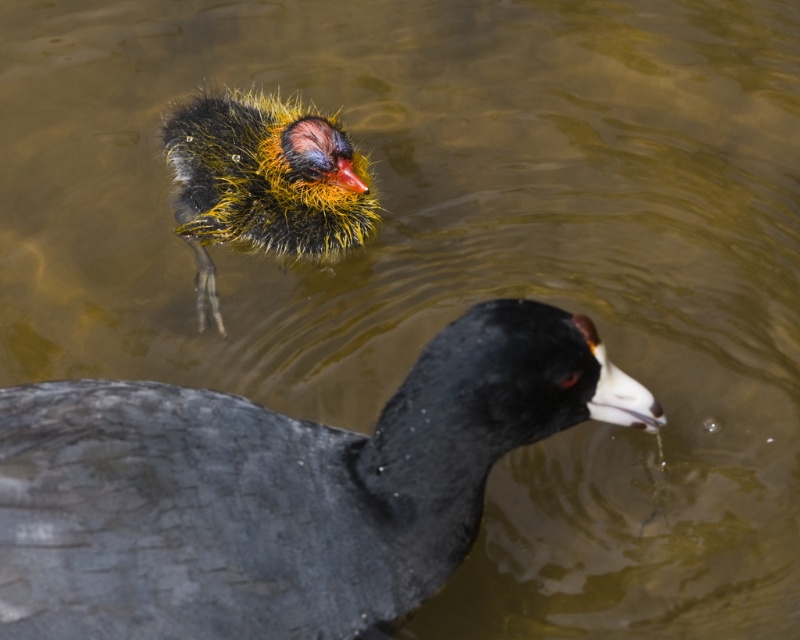
You are standing 1.5 meters away from the point marked at coordinates point (186, 548). Can you reach the point without moving closer?

The distance of point (186, 548) from viewer is 1.28 meters, so since you are currently 1.5 meters away, you can reach the point without moving closer because it is within your current distance.